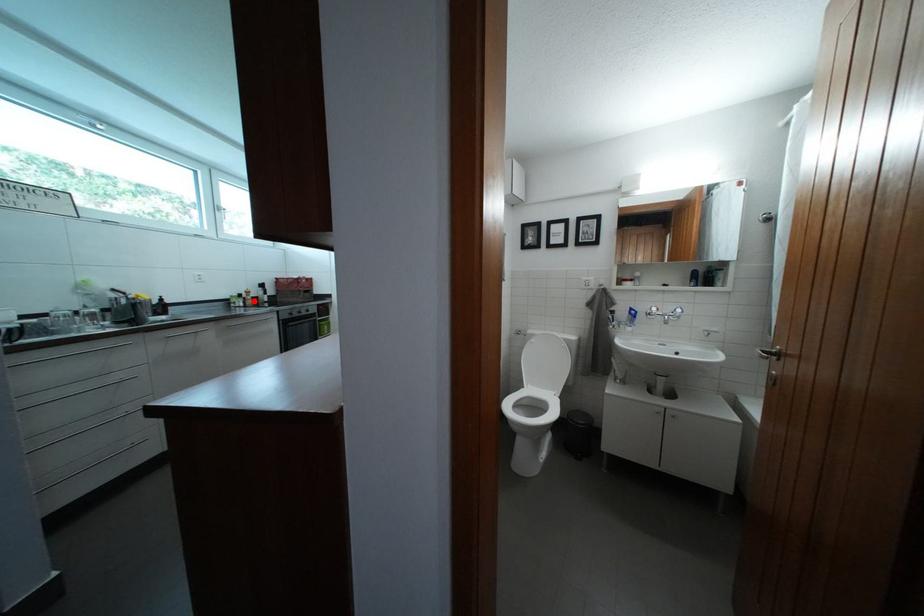
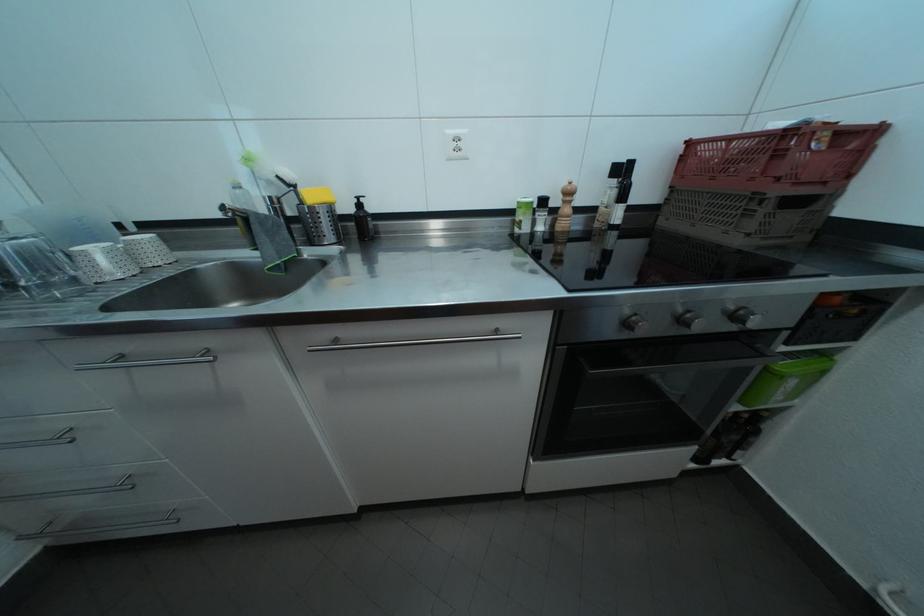
The point at the highlighted location is marked in the first image. Where is the corresponding point in the second image?

(564, 208)